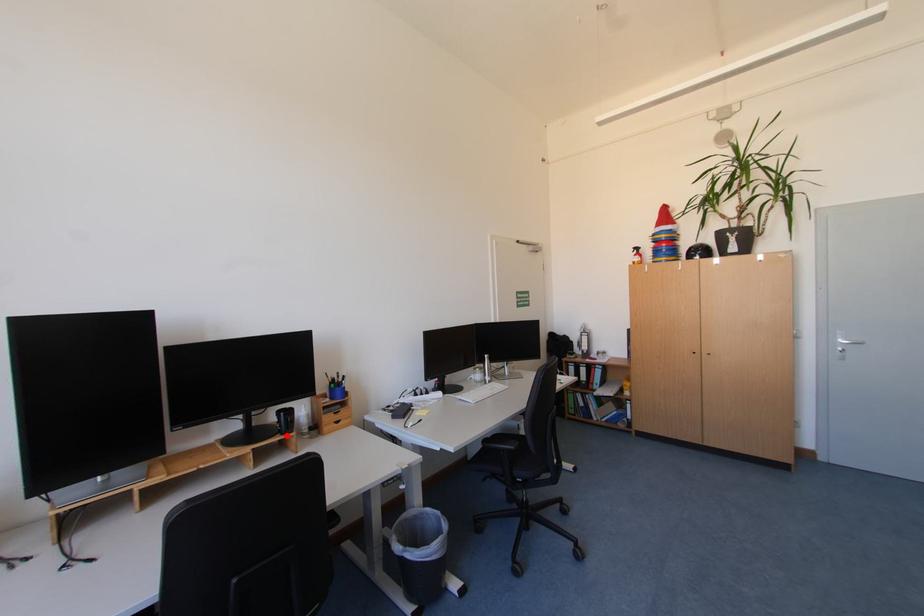
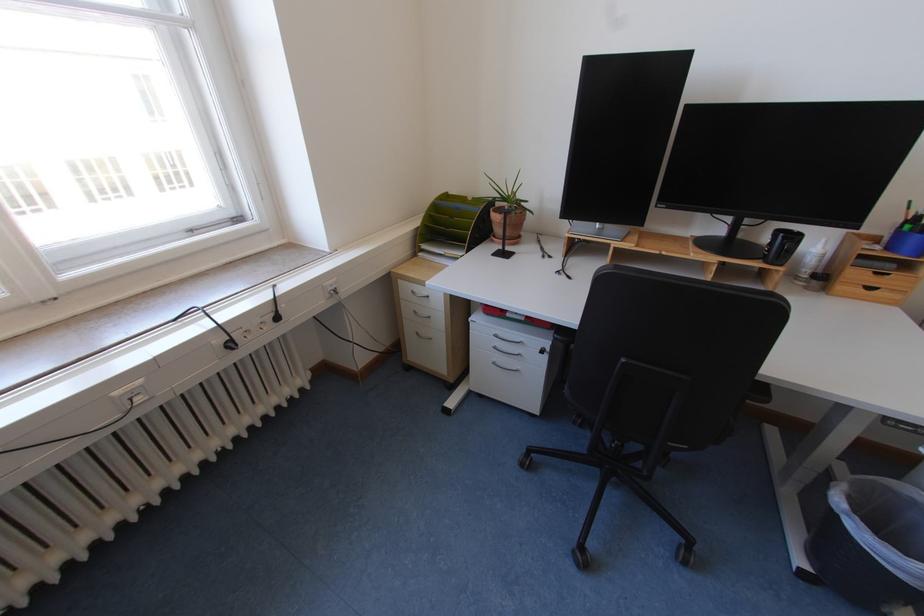
Find the pixel in the second image that matches the highlighted location in the first image.

(769, 262)